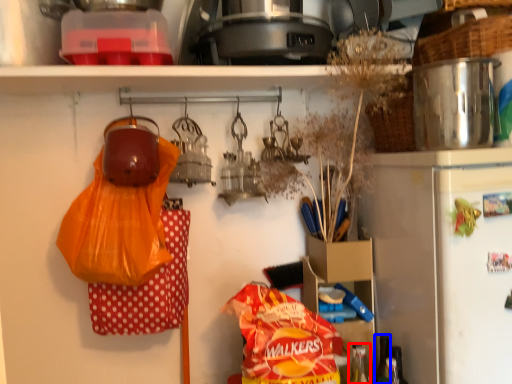
Question: Which object appears closest to the camera in this image, bottle (highlighted by a red box) or bottle (highlighted by a blue box)?

Choices:
 (A) bottle
 (B) bottle

Answer: (A)